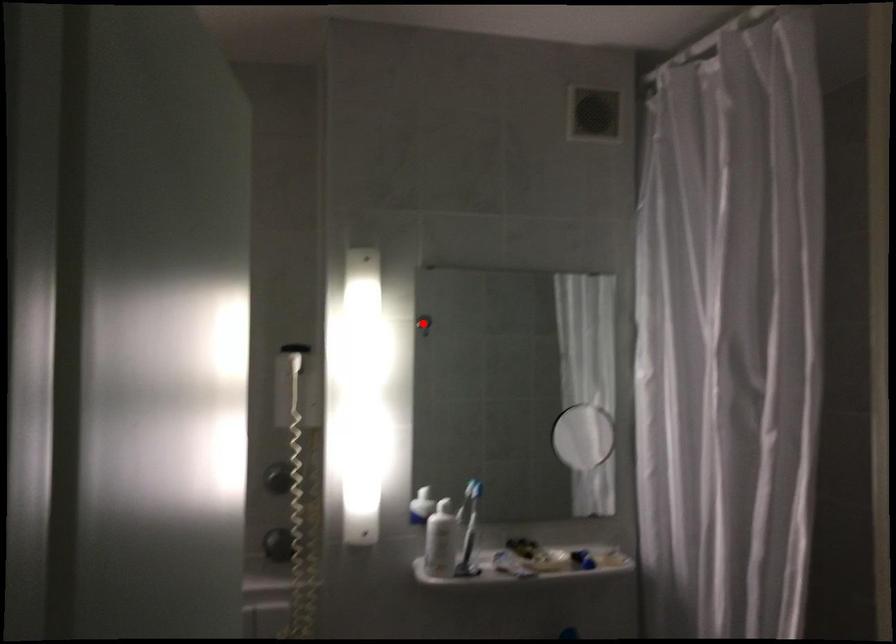
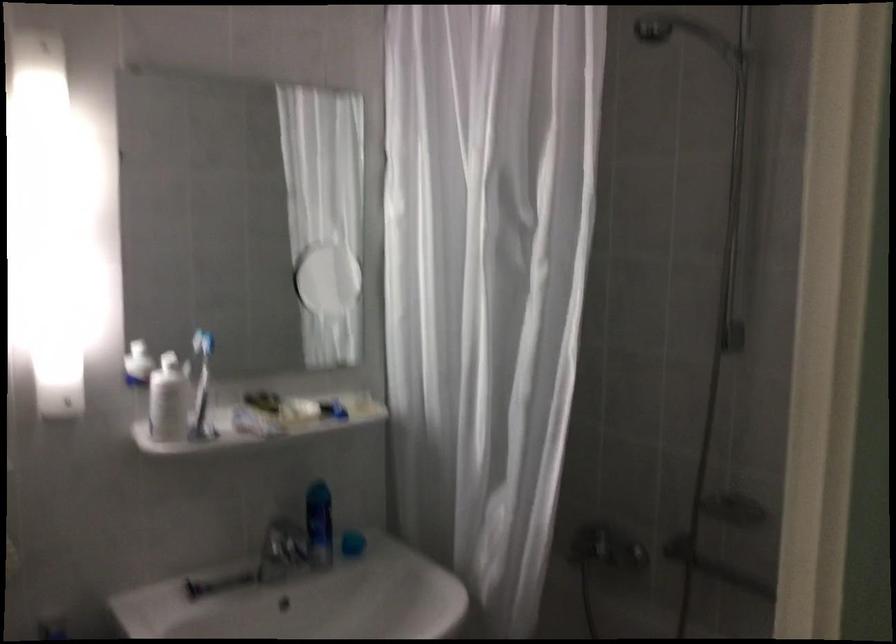
Where in the second image is the point corresponding to the highlighted location from the first image?

(116, 155)